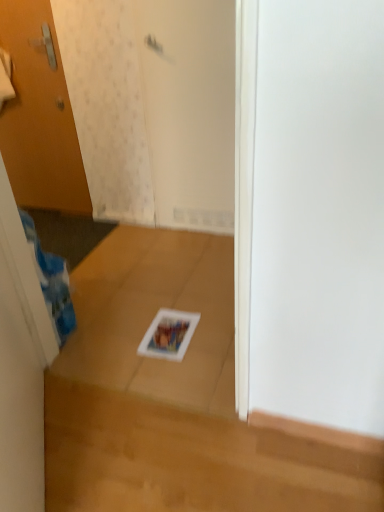
What are the coordinates of `vacant location below white matte screen door at upper center (from a real-world perspective)` in the screenshot? It's located at (195, 232).